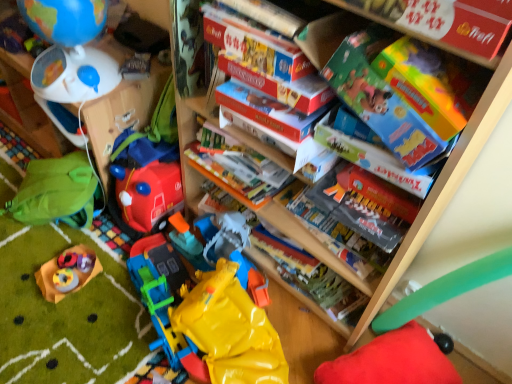
Question: Considering the positions of matte cardboard box at upper center, which is the 2th book from front to back, and red plush cushion at lower right, the 1th toy from the right, in the image, is matte cardboard box at upper center, which is the 2th book from front to back, bigger or smaller than red plush cushion at lower right, the 1th toy from the right,?

Choices:
 (A) big
 (B) small

Answer: (B)

Question: Would you say matte cardboard box at upper center, which is the 2th book from front to back, is inside or outside red plush cushion at lower right, which ranks as the sixth toy in left-to-right order?

Choices:
 (A) inside
 (B) outside

Answer: (B)

Question: Considering the real-world distances, which object is farthest from the hardcover book at center, placed as the 1th book when sorted from back to front?

Choices:
 (A) green fabric backpack at left, the first shelf from the front
 (B) yellow rubber toy at lower center, marked as the second toy in a right-to-left arrangement
 (C) matte gray book at center, which is the second book from back to front
 (D) rubberized yellow toy at lower left, placed as the 4th toy when sorted from right to left
 (E) matte blue globe at upper left, marked as the 6th toy in a right-to-left arrangement

Answer: (E)

Question: Based on their relative distances, which object is nearer to the green fabric backpack at left, which ranks as the 2th shelf in back-to-front order?

Choices:
 (A) matte cardboard box at upper right, which is the fourth book in back-to-front order
 (B) matte blue globe at upper left, marked as the 6th toy in a right-to-left arrangement
 (C) white plastic cup at upper left, acting as the 2th shelf starting from the right
 (D) red plush cushion at lower right, which ranks as the sixth toy in left-to-right order
 (E) rubberized yellow toy at lower left, placed as the 4th toy when sorted from right to left

Answer: (B)